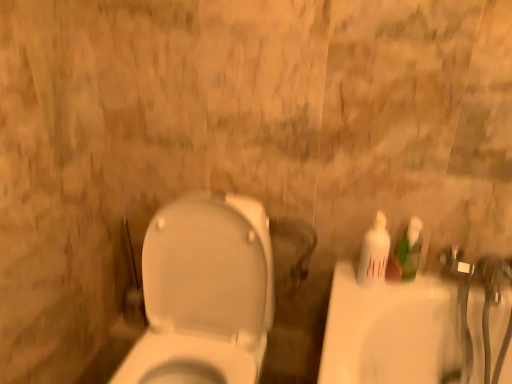
Question: Choose the correct answer: Is white glossy toilet at center inside white glossy bottle at right, acting as the first mouthwash starting from the left, or outside it?

Choices:
 (A) inside
 (B) outside

Answer: (B)

Question: From the image's perspective, is white glossy toilet at center positioned above or below white glossy bottle at right, acting as the first mouthwash starting from the left?

Choices:
 (A) below
 (B) above

Answer: (A)

Question: Which object is positioned farthest from the white glossy bottle at right, acting as the first mouthwash starting from the left?

Choices:
 (A) white glossy toilet at center
 (B) green plastic bottle at right, marked as the 1th mouthwash in a right-to-left arrangement

Answer: (A)

Question: Based on their relative distances, which object is farther from the white glossy bottle at right, acting as the first mouthwash starting from the left?

Choices:
 (A) green plastic bottle at right, marked as the 1th mouthwash in a right-to-left arrangement
 (B) white glossy toilet at center

Answer: (B)